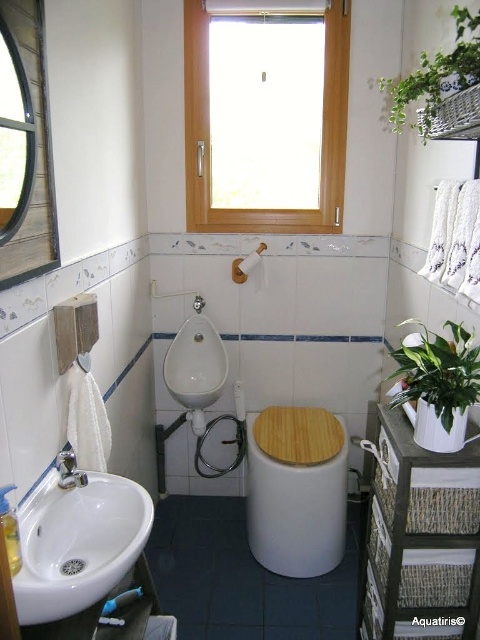
You are a plumber inspecting the bathroom layout. You need to replace the white glossy urinal at center and the white glossy toilet bowl at lower right. Which one requires a larger replacement part?

The white glossy urinal at center requires a larger replacement part because it is larger in size than the white glossy toilet bowl at lower right.

You are standing in the bathroom and need to locate the white matte toilet bowl at center. According to the coordinates provided, where should you look?

The white matte toilet bowl at center is located at point coordinates of (x=296, y=490).

You are standing in the bathroom and want to reach the point at point (122, 557). You have a 3.5 feet long stick. Can you reach the point with the stick?

Yes, because the distance between you and the point is 3.51 feet, and the stick is 3.5 feet long, so you can reach it.